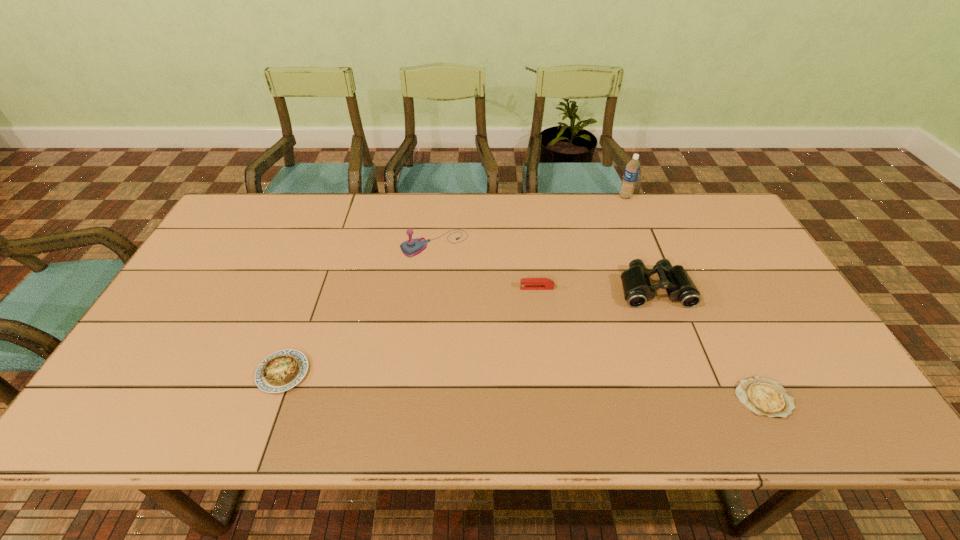
I want to click on water bottle, so click(x=632, y=169).

What are the coordinates of `the tallest object` in the screenshot? It's located at (632, 169).

Locate an element on the screen. The width and height of the screenshot is (960, 540). the second farthest object is located at coordinates (412, 247).

Where is `the second object from left to right`? Image resolution: width=960 pixels, height=540 pixels. the second object from left to right is located at coordinates (412, 247).

Locate an element on the screen. binoculars is located at coordinates (637, 287).

Find the location of a particular element. Image resolution: width=960 pixels, height=540 pixels. the third shortest object is located at coordinates point(526,283).

Locate an element on the screen. stapler is located at coordinates (526, 283).

The image size is (960, 540). Identify the location of the fifth tallest object. (280, 371).

At what (x,y) coordinates should I click in order to perform the action: click on the leftmost object. Please return your answer as a coordinate pair (x, y). Image resolution: width=960 pixels, height=540 pixels. Looking at the image, I should click on (280, 371).

Find the location of a particular element. the shortest object is located at coordinates (765, 397).